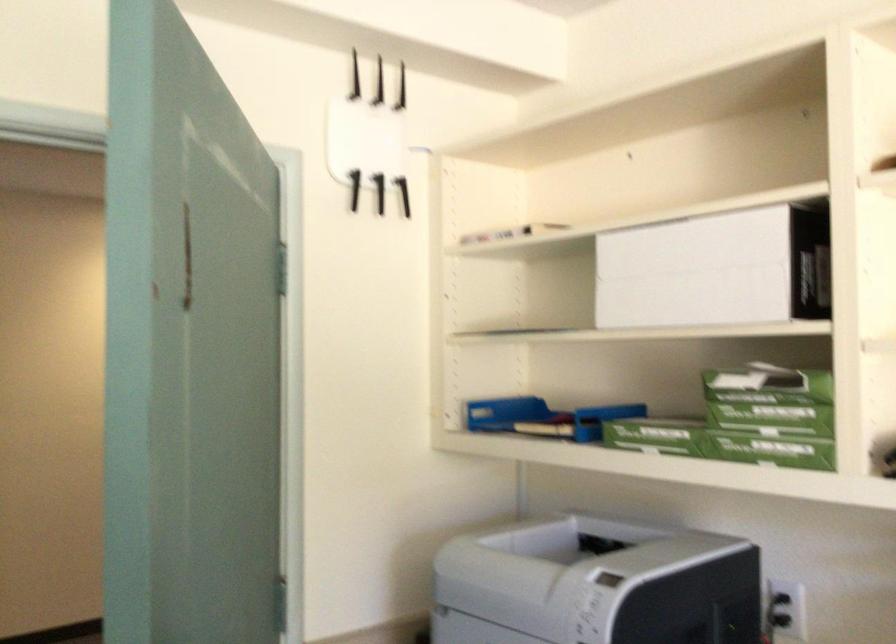
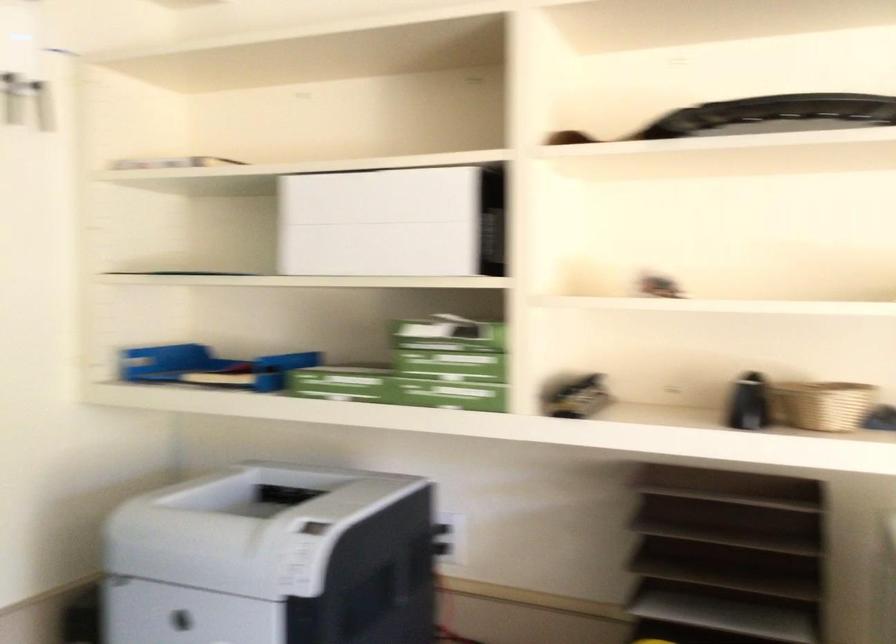
Question: The camera is either moving clockwise (left) or counter-clockwise (right) around the object. The first image is from the beginning of the video and the second image is from the end. Is the camera moving left or right when shooting the video?

Choices:
 (A) Left
 (B) Right

Answer: (A)